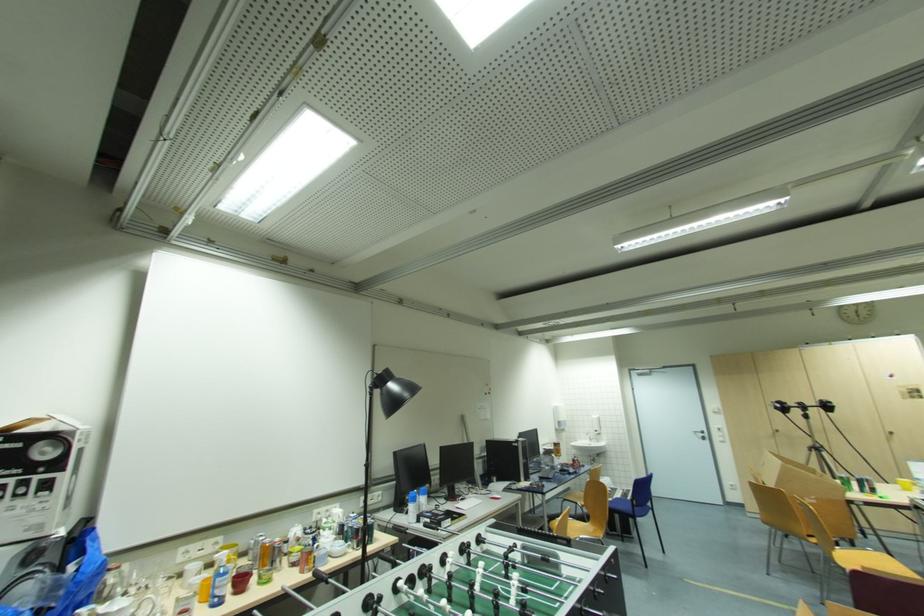
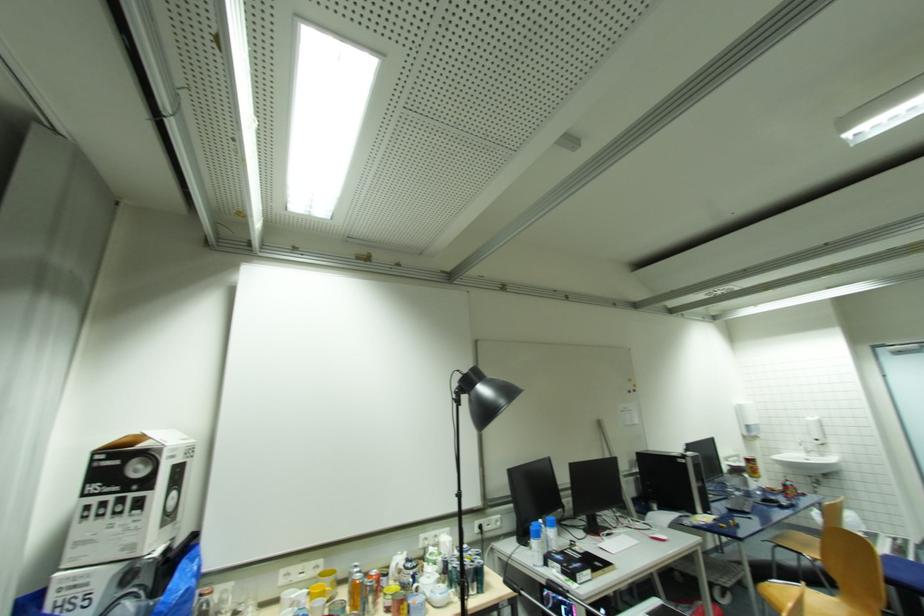
Question: The images are taken continuously from a first-person perspective. In which direction are you moving?

Choices:
 (A) Left
 (B) Right
 (C) Forward
 (D) Backward

Answer: (C)